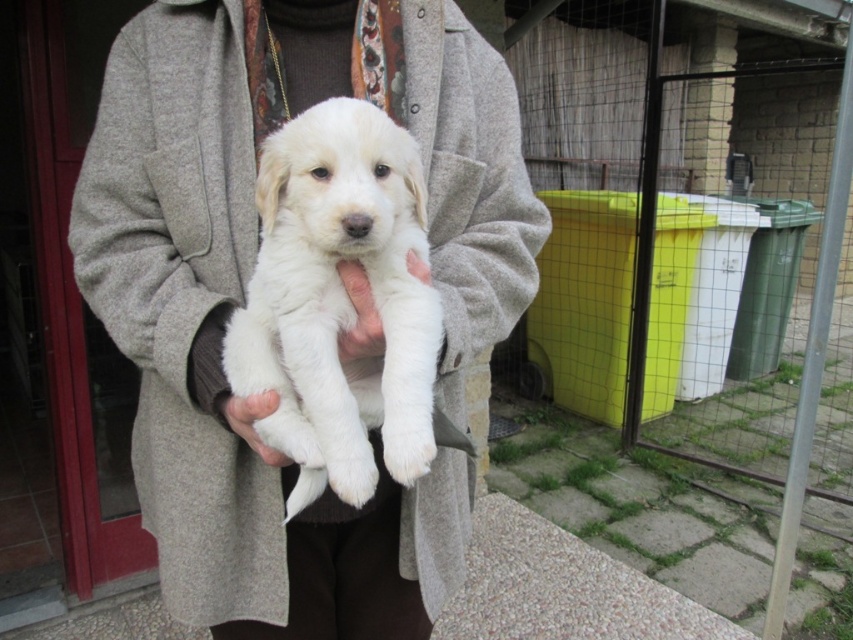
Question: Can you confirm if white fur puppy at center is bigger than white fluffy puppy at center?

Choices:
 (A) no
 (B) yes

Answer: (B)

Question: Which of the following is the closest to the observer?

Choices:
 (A) (264, 412)
 (B) (477, 214)
 (C) (361, 496)

Answer: (C)

Question: Which object is positioned closest to the white fur at center?

Choices:
 (A) white fluffy puppy at center
 (B) white fur puppy at center

Answer: (A)

Question: Can you confirm if white fur puppy at center is positioned below white fur at center?

Choices:
 (A) no
 (B) yes

Answer: (A)

Question: Is white fluffy puppy at center below white fur at center?

Choices:
 (A) no
 (B) yes

Answer: (A)

Question: Based on their relative distances, which object is nearer to the white fluffy puppy at center?

Choices:
 (A) white fur at center
 (B) white fur puppy at center

Answer: (B)